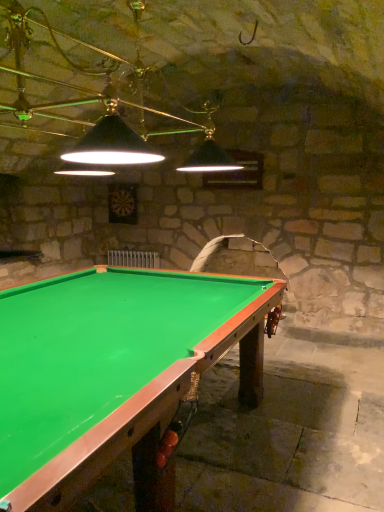
Question: Does black matte lampshade at upper center have a larger size compared to green felt billiard table at center?

Choices:
 (A) yes
 (B) no

Answer: (B)

Question: Is black matte lampshade at upper center oriented towards green felt billiard table at center?

Choices:
 (A) no
 (B) yes

Answer: (A)

Question: Is black matte lampshade at upper center oriented away from green felt billiard table at center?

Choices:
 (A) yes
 (B) no

Answer: (B)

Question: Can you confirm if black matte lampshade at upper center is positioned to the right of green felt billiard table at center?

Choices:
 (A) no
 (B) yes

Answer: (A)

Question: From a real-world perspective, is black matte lampshade at upper center on top of green felt billiard table at center?

Choices:
 (A) no
 (B) yes

Answer: (B)

Question: Is black matte lampshade at upper center wider than green felt billiard table at center?

Choices:
 (A) yes
 (B) no

Answer: (B)

Question: Could you tell me if green felt billiard table at center is turned towards black matte lampshade at upper center?

Choices:
 (A) yes
 (B) no

Answer: (B)

Question: Is green felt billiard table at center placed right next to black matte lampshade at upper center?

Choices:
 (A) yes
 (B) no

Answer: (B)

Question: Is green felt billiard table at center closer to camera compared to black matte lampshade at upper center?

Choices:
 (A) no
 (B) yes

Answer: (B)

Question: Is green felt billiard table at center shorter than black matte lampshade at upper center?

Choices:
 (A) no
 (B) yes

Answer: (B)

Question: Are green felt billiard table at center and black matte lampshade at upper center located far from each other?

Choices:
 (A) no
 (B) yes

Answer: (B)

Question: From the image's perspective, is green felt billiard table at center under black matte lampshade at upper center?

Choices:
 (A) yes
 (B) no

Answer: (A)

Question: Considering the positions of black matte lampshade at upper center and green felt billiard table at center in the image, is black matte lampshade at upper center taller or shorter than green felt billiard table at center?

Choices:
 (A) tall
 (B) short

Answer: (A)